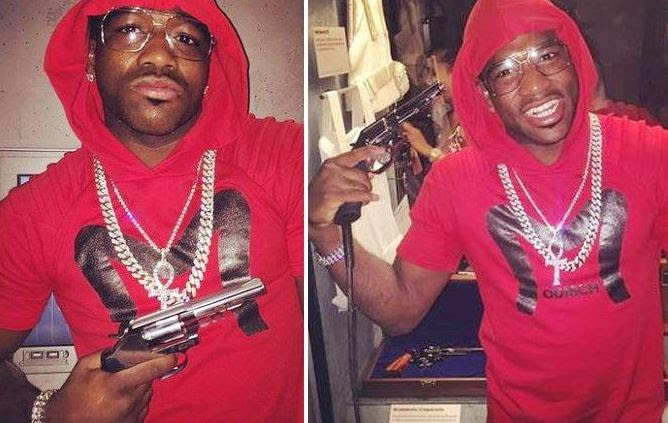
What are the coordinates of `cord` in the screenshot? It's located at (353, 368).